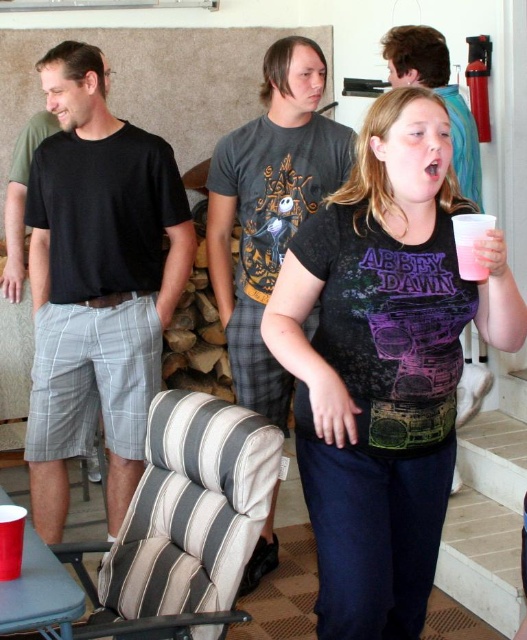
Question: Which object appears farthest from the camera in this image?

Choices:
 (A) black matte t-shirt at center
 (B) pink plastic cup at right

Answer: (A)

Question: Which of the following is the closest to the observer?

Choices:
 (A) (300, 387)
 (B) (208, 179)
 (C) (1, 556)

Answer: (C)

Question: Does black cotton t-shirt at left come in front of red plastic cup at lower left?

Choices:
 (A) yes
 (B) no

Answer: (B)

Question: Does dark gray t-shirt at center appear under pink plastic cup at right?

Choices:
 (A) yes
 (B) no

Answer: (B)

Question: Which of the following is the farthest from the observer?

Choices:
 (A) red plastic cup at lower left
 (B) dark gray t-shirt at center
 (C) black cotton t-shirt at left

Answer: (B)

Question: Is the position of black cotton t-shirt at left more distant than that of red plastic cup at lower left?

Choices:
 (A) no
 (B) yes

Answer: (B)